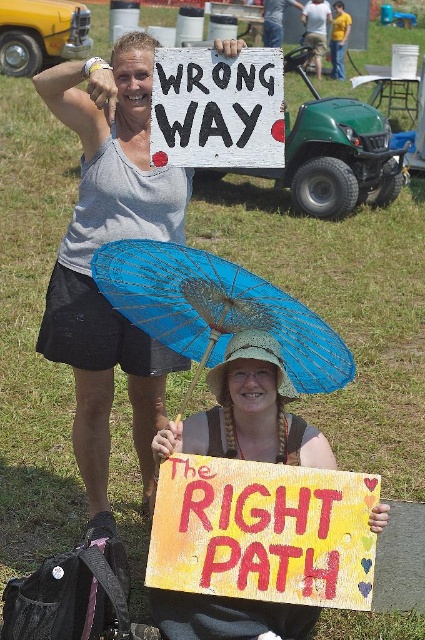
Can you confirm if yellow painted wood sign at lower center is bigger than blue paper parasol at lower center?

No.

Between point (368, 525) and point (269, 320), which one is positioned in front?

Point (368, 525)

Between point (183, 572) and point (195, 332), which one is positioned behind?

The point (195, 332) is more distant.

Find the location of a particular element. yellow painted wood sign at lower center is located at coordinates [263, 531].

Measure the distance between matte gray tank top at upper left and light blue fabric umbrella at center.

A distance of 44.66 feet exists between matte gray tank top at upper left and light blue fabric umbrella at center.

Between matte gray tank top at upper left and light blue fabric umbrella at center, which one is positioned lower?

matte gray tank top at upper left is below.

Is point (99, 202) farther from viewer compared to point (300, 17)?

No, it is in front of (300, 17).

The width and height of the screenshot is (425, 640). What are the coordinates of `matte gray tank top at upper left` in the screenshot? It's located at (99, 244).

Between matte gray tank top at upper left and yellow shirt at upper center, which one appears on the right side from the viewer's perspective?

yellow shirt at upper center

Can you confirm if matte gray tank top at upper left is positioned to the right of yellow shirt at upper center?

Incorrect, matte gray tank top at upper left is not on the right side of yellow shirt at upper center.

This screenshot has width=425, height=640. I want to click on matte gray tank top at upper left, so click(99, 244).